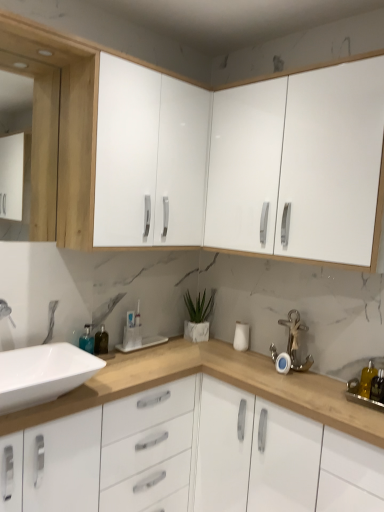
Question: From a real-world perspective, is white glossy cabinet at upper right, the 2th cabinetry positioned from the bottom, physically located above or below white glossy cabinet at center, the 1th cabinetry in the bottom-to-top sequence?

Choices:
 (A) below
 (B) above

Answer: (B)

Question: Would you say white glossy cabinet at upper right, the 2th cabinetry positioned from the bottom, is to the left or to the right of white glossy cabinet at center, the 1th cabinetry in the bottom-to-top sequence, in the picture?

Choices:
 (A) right
 (B) left

Answer: (A)

Question: Which object is the closest to the yellow translucent soap dispenser at right?

Choices:
 (A) silver metallic anchor at lower right
 (B) white glossy cabinet at upper left, the 3th cabinetry positioned from the bottom
 (C) translucent amber bottle at lower left
 (D) translucent plastic bottle at lower right
 (E) white marble planter at center

Answer: (D)

Question: Which of these objects is positioned closest to the white marble planter at center?

Choices:
 (A) white glossy cabinet at upper left, the 3th cabinetry positioned from the bottom
 (B) white glossy sink at lower left
 (C) translucent amber bottle at lower left
 (D) white glossy cabinet at center, acting as the third cabinetry starting from the top
 (E) yellow translucent soap dispenser at right

Answer: (C)